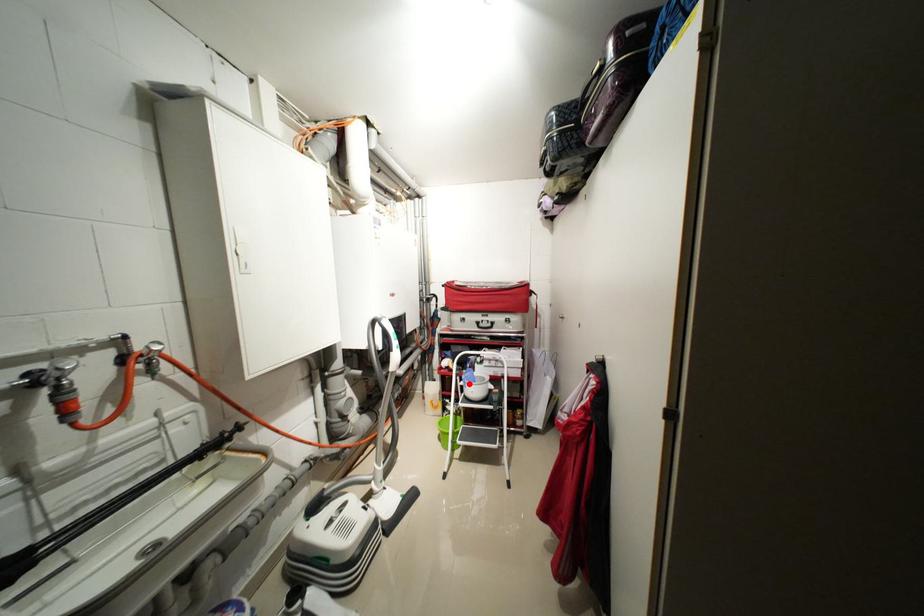
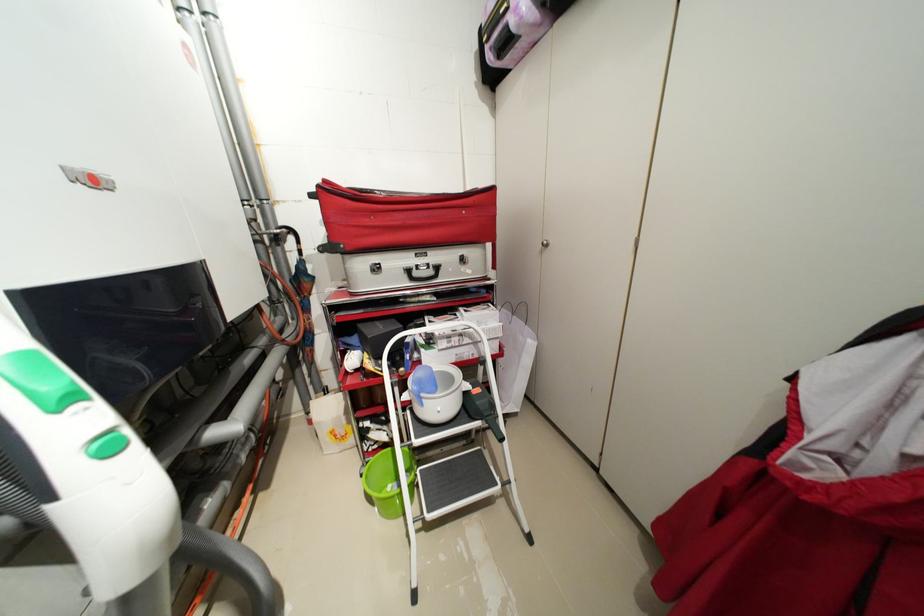
Locate, in the second image, the point that corresponds to the highlighted location in the first image.

(412, 398)